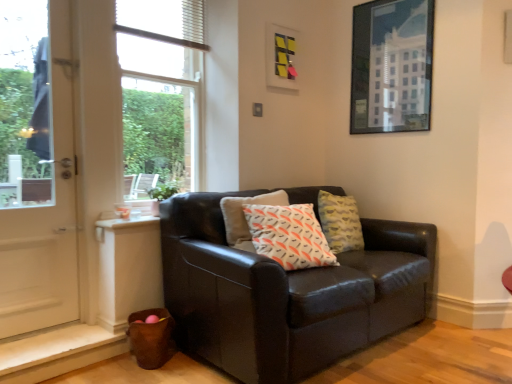
Question: Would you consider matte black couch at center to be distant from white textured blind at upper center?

Choices:
 (A) yes
 (B) no

Answer: (A)

Question: Is matte black couch at center thinner than white textured blind at upper center?

Choices:
 (A) yes
 (B) no

Answer: (B)

Question: Considering the relative positions of matte black couch at center and white textured blind at upper center in the image provided, is matte black couch at center to the right of white textured blind at upper center from the viewer's perspective?

Choices:
 (A) no
 (B) yes

Answer: (B)

Question: From a real-world perspective, is matte black couch at center positioned under white textured blind at upper center based on gravity?

Choices:
 (A) no
 (B) yes

Answer: (B)

Question: Could you tell me if matte black couch at center is facing white textured blind at upper center?

Choices:
 (A) no
 (B) yes

Answer: (A)

Question: Is matte black couch at center taller than white textured blind at upper center?

Choices:
 (A) yes
 (B) no

Answer: (A)

Question: From the image's perspective, would you say clear glass window at upper left is shown under white glossy door at left?

Choices:
 (A) no
 (B) yes

Answer: (A)

Question: Considering the relative sizes of clear glass window at upper left and white glossy door at left in the image provided, is clear glass window at upper left wider than white glossy door at left?

Choices:
 (A) yes
 (B) no

Answer: (B)

Question: Is clear glass window at upper left not inside white glossy door at left?

Choices:
 (A) yes
 (B) no

Answer: (A)

Question: Can you confirm if clear glass window at upper left is shorter than white glossy door at left?

Choices:
 (A) yes
 (B) no

Answer: (A)

Question: From the image's perspective, does clear glass window at upper left appear higher than white glossy door at left?

Choices:
 (A) yes
 (B) no

Answer: (A)

Question: Is clear glass window at upper left surrounding white glossy door at left?

Choices:
 (A) yes
 (B) no

Answer: (B)

Question: Is metallic glass picture frame at upper right, marked as the second picture frame in a left-to-right arrangement, further to the viewer compared to white glossy door at left?

Choices:
 (A) yes
 (B) no

Answer: (A)